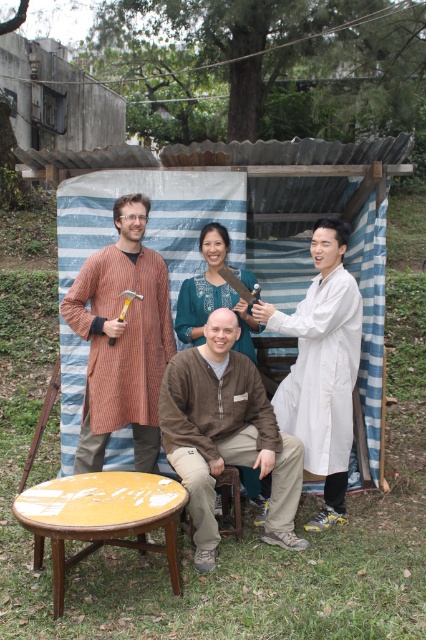
In the scene shown: You are organizing a clothing donation drive and need to determine if the striped cotton robe at left and the blue embroidered blouse at center can fit into a standard donation box that measures 30x30x30 cm. Based on their sizes, will both items fit comfortably?

The striped cotton robe at left is larger in size than the blue embroidered blouse at center. Since the robe is bigger, it might not fit comfortably into the 30x30x30 cm donation box along with the blouse. You may need a larger box or separate them.

You are standing in front of the scene and want to determine which of the two points, point (126, 278) or point (176, 321), is closer to you. Based on the coordinates provided, which point is nearer?

Point (126, 278) is closer to the camera than point (176, 321), so it is the nearer one.

You are a photographer trying to capture a group photo of the brown cotton shirt at center and the blue embroidered blouse at center. Since you want both subjects to appear balanced in the frame, which subject should you position closer to the camera to compensate for their size difference?

You should position the blue embroidered blouse at center closer to the camera because the brown cotton shirt at center is taller. By placing the shorter blue embroidered blouse at center nearer, their apparent sizes in the photo will be more balanced.